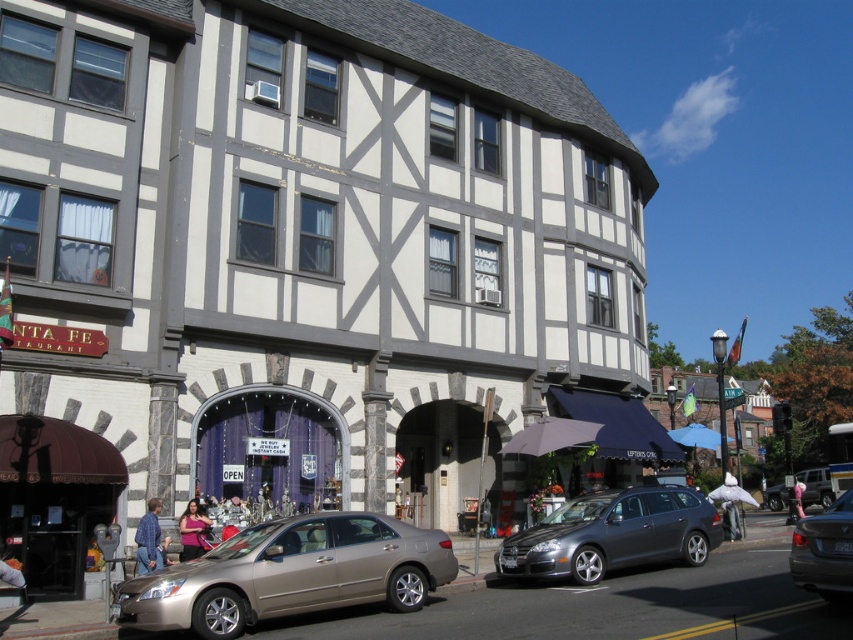
Is gold metallic sedan at center bigger than metallic silver sedan at center?

Incorrect, gold metallic sedan at center is not larger than metallic silver sedan at center.

Which of these two, gold metallic sedan at center or metallic silver sedan at center, stands taller?

Standing taller between the two is metallic silver sedan at center.

Measure the distance between gold metallic sedan at center and camera.

gold metallic sedan at center and camera are 14.71 meters apart from each other.

The height and width of the screenshot is (640, 853). What are the coordinates of `gold metallic sedan at center` in the screenshot? It's located at (291, 573).

Is metallic gray station wagon at center bigger than metallic silver sedan at center?

Actually, metallic gray station wagon at center might be smaller than metallic silver sedan at center.

Is point (590, 516) farther from viewer compared to point (844, 548)?

Yes, it is.

Is point (697, 497) farther from viewer compared to point (822, 561)?

That is True.

I want to click on metallic gray station wagon at center, so click(612, 534).

Does gold metallic sedan at center have a larger size compared to metallic gray station wagon at center?

No, gold metallic sedan at center is not bigger than metallic gray station wagon at center.

Who is higher up, gold metallic sedan at center or metallic gray station wagon at center?

Positioned higher is gold metallic sedan at center.

Which is behind, point (229, 556) or point (622, 540)?

The point (622, 540) is behind.

You are a GUI agent. You are given a task and a screenshot of the screen. Output one action in this format:
    pyautogui.click(x=<x>, y=<y>)
    Task: Click on the gold metallic sedan at center
    This screenshot has width=853, height=640.
    Given the screenshot: What is the action you would take?
    pyautogui.click(x=291, y=573)